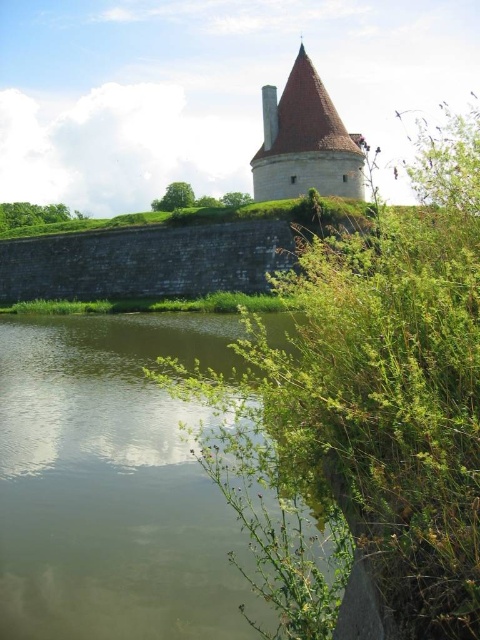
You are standing at the center of the historic stone structure and want to reach the green grassy river at lower left. Which direction should you walk to get there?

You should walk towards the lower left direction to reach the green grassy river at lower left.

You are a small boat operator who needs to navigate through the green grassy river at lower left. The smooth beige stone tower at upper center is in your path. Can you safely pass under it without hitting the tower?

The green grassy river at lower left might be wider than smooth beige stone tower at upper center, so there is a possibility that the boat can pass safely. However, the exact dimensions are uncertain based on the provided information.

You are standing at the base of the smooth beige stone tower at upper center and want to cross to the green grassy river at lower left. Which direction should you move to reach the river?

You should move downward to reach the green grassy river at lower left since it has a lesser height compared to the smooth beige stone tower at upper center.